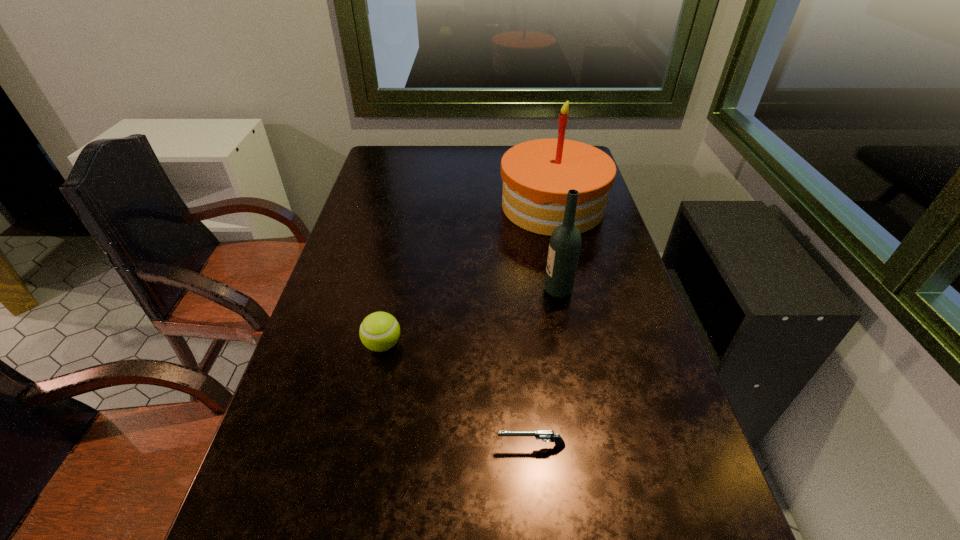
At what (x,y) coordinates should I click in order to perform the action: click on the farthest object. Please return your answer as a coordinate pair (x, y). The height and width of the screenshot is (540, 960). Looking at the image, I should click on (537, 175).

Identify the location of wine bottle. (565, 243).

Find the location of a particular element. This screenshot has height=540, width=960. the second farthest object is located at coordinates (565, 243).

Image resolution: width=960 pixels, height=540 pixels. I want to click on the second shortest object, so click(x=379, y=331).

You are a GUI agent. You are given a task and a screenshot of the screen. Output one action in this format:
    pyautogui.click(x=<x>, y=<y>)
    Task: Click on the leftmost object
    The width and height of the screenshot is (960, 540).
    Given the screenshot: What is the action you would take?
    pyautogui.click(x=379, y=331)

At what (x,y) coordinates should I click in order to perform the action: click on pistol. Please return your answer as a coordinate pair (x, y). Looking at the image, I should click on (541, 434).

In order to click on the shortest object in this screenshot , I will do `click(541, 434)`.

You are a GUI agent. You are given a task and a screenshot of the screen. Output one action in this format:
    pyautogui.click(x=<x>, y=<y>)
    Task: Click on the blank area located 0.150m on the back of the farthest object
    The height and width of the screenshot is (540, 960).
    Given the screenshot: What is the action you would take?
    pyautogui.click(x=542, y=160)

At what (x,y) coordinates should I click in order to perform the action: click on free spot located 0.100m on the labeled side of the second farthest object. Please return your answer as a coordinate pair (x, y). The width and height of the screenshot is (960, 540). Looking at the image, I should click on (506, 291).

Where is `free spot located on the labeled side of the second farthest object`? free spot located on the labeled side of the second farthest object is located at coordinates (487, 291).